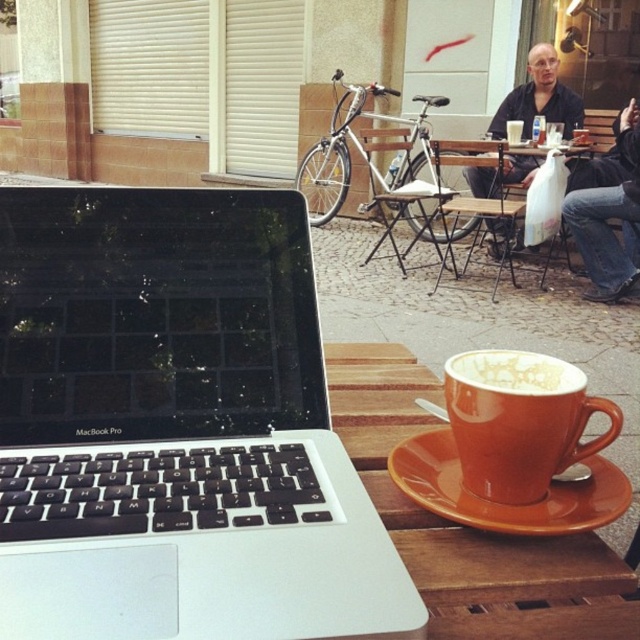
You are a barista at the outdoor cafe and need to place a new menu on the table. The menu is the same size as the dark shirt at center. Can the orange ceramic saucer at lower center fit entirely under the menu without overlapping?

The orange ceramic saucer at lower center is smaller than the dark shirt at center, so the saucer will fit entirely under the menu since the menu is the same size as the shirt.

You are a customer at the outdoor cafe and want to place your phone between the orange matte mug at lower center and the dark shirt at center. Can you fit it there?

The orange matte mug at lower center is not as tall as the dark shirt at center, so there is vertical space between them. You can place your phone between the orange matte mug at lower center and the dark shirt at center.

You are a customer at the outdoor cafe and want to place your phone between the silver metallic laptop at center and the orange ceramic saucer at lower center. Can you do this without moving either object?

The silver metallic laptop at center is in front of the orange ceramic saucer at lower center, so there is no space between them for placing your phone. You would need to move one of the objects to make room.